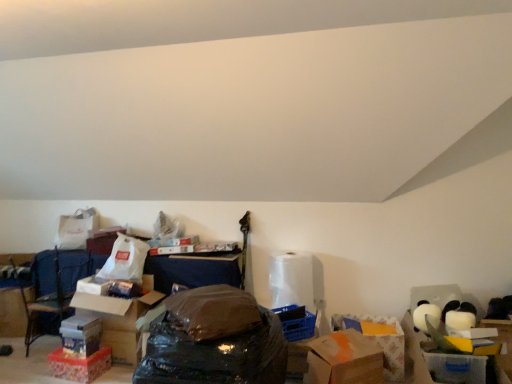
Question: Is matte cardboard box at lower left, arranged as the third storage box when viewed from the front, closer to camera compared to orange matte cardboard box at center, which is the first cardboard box from right to left?

Choices:
 (A) yes
 (B) no

Answer: (B)

Question: Is matte cardboard box at lower left, arranged as the third storage box when viewed from the front, not within orange matte cardboard box at center, which is the first cardboard box from right to left?

Choices:
 (A) yes
 (B) no

Answer: (A)

Question: Is orange matte cardboard box at center, which is the first cardboard box from right to left, at the back of matte cardboard box at lower left, arranged as the third storage box when viewed from the front?

Choices:
 (A) no
 (B) yes

Answer: (A)

Question: Considering the relative sizes of matte cardboard box at lower left, arranged as the third storage box when viewed from the front, and orange matte cardboard box at center, placed as the second cardboard box when sorted from left to right, in the image provided, is matte cardboard box at lower left, arranged as the third storage box when viewed from the front, thinner than orange matte cardboard box at center, placed as the second cardboard box when sorted from left to right,?

Choices:
 (A) yes
 (B) no

Answer: (A)

Question: Could orange matte cardboard box at center, which is the first cardboard box from right to left, be considered to be inside matte cardboard box at lower left, arranged as the 2th storage box when viewed from the right?

Choices:
 (A) no
 (B) yes

Answer: (A)

Question: In terms of width, does blue fabric armchair at lower left look wider or thinner when compared to orange matte cardboard box at center, which is the first cardboard box from right to left?

Choices:
 (A) wide
 (B) thin

Answer: (A)

Question: Is blue fabric armchair at lower left taller or shorter than orange matte cardboard box at center, which is the first cardboard box from right to left?

Choices:
 (A) tall
 (B) short

Answer: (A)

Question: Would you say blue fabric armchair at lower left is to the left or to the right of orange matte cardboard box at center, placed as the second cardboard box when sorted from left to right, in the picture?

Choices:
 (A) right
 (B) left

Answer: (B)

Question: Considering the positions of blue fabric armchair at lower left and orange matte cardboard box at center, which is the first cardboard box from right to left, in the image, is blue fabric armchair at lower left bigger or smaller than orange matte cardboard box at center, which is the first cardboard box from right to left,?

Choices:
 (A) big
 (B) small

Answer: (A)

Question: Is cardboard box at lower left, acting as the second cardboard box starting from the right, in front of or behind brown cardboard box at lower right in the image?

Choices:
 (A) front
 (B) behind

Answer: (B)

Question: In terms of size, does cardboard box at lower left, marked as the 1th cardboard box in a left-to-right arrangement, appear bigger or smaller than brown cardboard box at lower right?

Choices:
 (A) big
 (B) small

Answer: (A)

Question: Would you say cardboard box at lower left, acting as the second cardboard box starting from the right, is to the left or to the right of brown cardboard box at lower right in the picture?

Choices:
 (A) right
 (B) left

Answer: (B)

Question: Is cardboard box at lower left, marked as the 1th cardboard box in a left-to-right arrangement, wider or thinner than brown cardboard box at lower right?

Choices:
 (A) thin
 (B) wide

Answer: (B)

Question: Relative to white matte toilet paper at center, is brown cardboard box at lower right in front or behind?

Choices:
 (A) behind
 (B) front

Answer: (B)

Question: From the image's perspective, is brown cardboard box at lower right positioned above or below white matte toilet paper at center?

Choices:
 (A) above
 (B) below

Answer: (B)